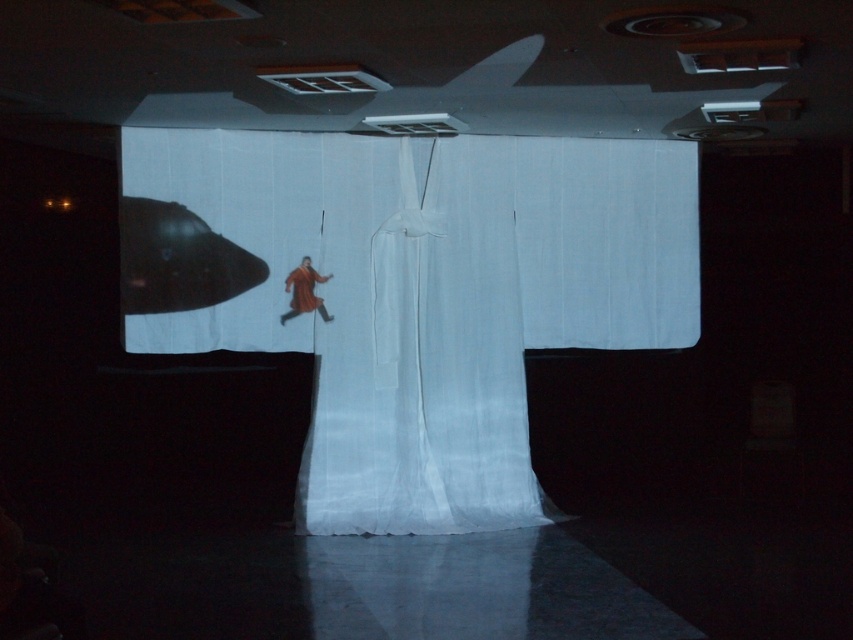
Question: Which of the following is the closest to the observer?

Choices:
 (A) red velvet kimono at center
 (B) white sheer curtain at center

Answer: (B)

Question: Is white sheer curtain at center to the left of red velvet kimono at center from the viewer's perspective?

Choices:
 (A) yes
 (B) no

Answer: (B)

Question: Which of the following is the farthest from the observer?

Choices:
 (A) red velvet kimono at center
 (B) white sheer curtain at center

Answer: (A)

Question: Is white sheer curtain at center behind red velvet kimono at center?

Choices:
 (A) no
 (B) yes

Answer: (A)

Question: Is white sheer curtain at center to the right of red velvet kimono at center from the viewer's perspective?

Choices:
 (A) no
 (B) yes

Answer: (B)